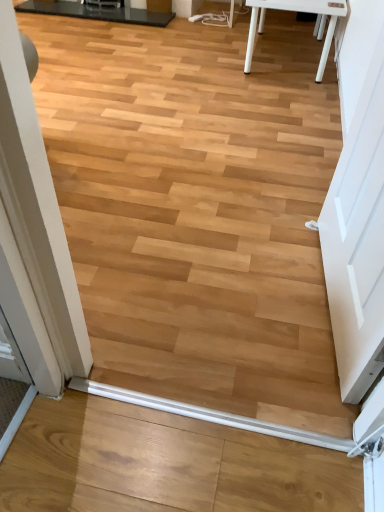
Question: From the image's perspective, would you say white matte door at right is positioned over white plastic beam at lower center?

Choices:
 (A) yes
 (B) no

Answer: (A)

Question: Considering the relative sizes of white matte door at right and white plastic beam at lower center in the image provided, is white matte door at right shorter than white plastic beam at lower center?

Choices:
 (A) yes
 (B) no

Answer: (B)

Question: Considering the relative sizes of white matte door at right and white plastic beam at lower center in the image provided, is white matte door at right smaller than white plastic beam at lower center?

Choices:
 (A) no
 (B) yes

Answer: (A)

Question: From the image's perspective, is white matte door at right below white plastic beam at lower center?

Choices:
 (A) yes
 (B) no

Answer: (B)

Question: Can you confirm if white matte door at right is wider than white plastic beam at lower center?

Choices:
 (A) yes
 (B) no

Answer: (A)

Question: Is black glossy table at upper left situated inside white matte door at right or outside?

Choices:
 (A) inside
 (B) outside

Answer: (B)

Question: From the image's perspective, is black glossy table at upper left positioned above or below white matte door at right?

Choices:
 (A) above
 (B) below

Answer: (A)

Question: Is black glossy table at upper left bigger or smaller than white matte door at right?

Choices:
 (A) big
 (B) small

Answer: (B)

Question: Looking at their shapes, would you say black glossy table at upper left is wider or thinner than white matte door at right?

Choices:
 (A) wide
 (B) thin

Answer: (A)

Question: Relative to white plastic beam at lower center, is black glossy table at upper left in front or behind?

Choices:
 (A) front
 (B) behind

Answer: (B)

Question: From the image's perspective, is black glossy table at upper left above or below white plastic beam at lower center?

Choices:
 (A) above
 (B) below

Answer: (A)

Question: Which is correct: black glossy table at upper left is inside white plastic beam at lower center, or outside of it?

Choices:
 (A) outside
 (B) inside

Answer: (A)

Question: From a real-world perspective, relative to white plastic beam at lower center, is black glossy table at upper left vertically above or below?

Choices:
 (A) above
 (B) below

Answer: (A)

Question: Is white matte door at right inside the boundaries of white plastic beam at lower center, or outside?

Choices:
 (A) outside
 (B) inside

Answer: (A)

Question: In the image, is white matte door at right positioned in front of or behind white plastic beam at lower center?

Choices:
 (A) front
 (B) behind

Answer: (A)